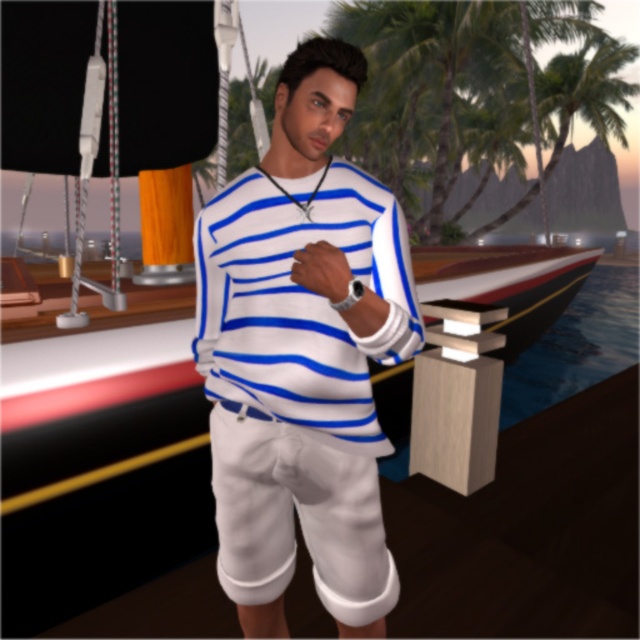
You are a photographer trying to capture the white striped sweater at center and the green leafy palm tree at upper center in the same frame. Based on their positions, which object should you adjust your camera to focus on first to ensure both are in the shot?

The white striped sweater at center is positioned on the left side of the green leafy palm tree at upper center, so you should focus on the green leafy palm tree at upper center first to ensure both are included in the frame.

You are a fashion designer observing the person in the scene. You need to determine which item of clothing is taller between the white matte sweater at center and the white cotton shorts at center. Which one is taller?

The white matte sweater at center is taller than the white cotton shorts at center.